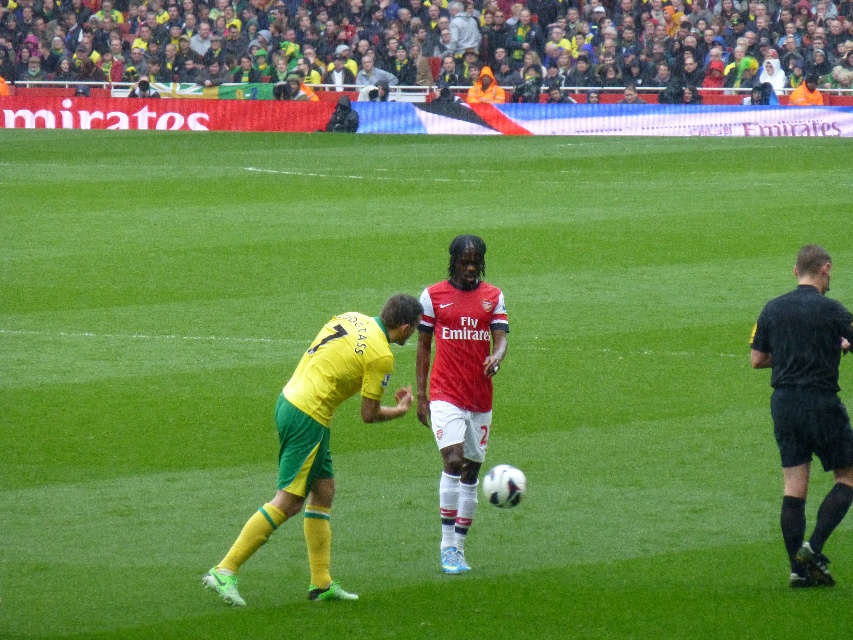
Is yellow-green jersey at center further to the viewer compared to black fabric shirt at right?

Yes, it is behind black fabric shirt at right.

Locate an element on the screen. yellow-green jersey at center is located at coordinates (437, 33).

Does point (318, 376) come in front of point (843, 509)?

That is True.

Measure the distance between yellow-green jersey at center-left and camera.

yellow-green jersey at center-left and camera are 8.38 meters apart.

Locate an element on the screen. yellow-green jersey at center-left is located at coordinates (321, 435).

Is point (795, 566) closer to camera compared to point (461, 512)?

Yes.

Does black fabric shirt at right appear on the left side of matte red jersey at center?

In fact, black fabric shirt at right is to the right of matte red jersey at center.

Is point (811, 534) more distant than point (424, 352)?

That is False.

The image size is (853, 640). In order to click on black fabric shirt at right in this screenshot , I will do [x=807, y=404].